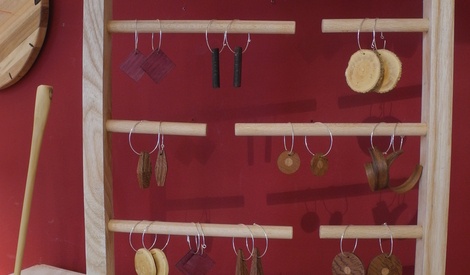
Image resolution: width=470 pixels, height=275 pixels. Find the location of `the right post of stand holding medals`. the right post of stand holding medals is located at coordinates (443, 137).